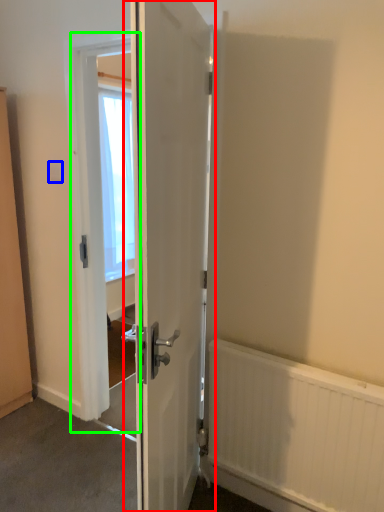
Question: Which object is positioned closest to door (highlighted by a red box)? Select from electric outlet (highlighted by a blue box) and screen door (highlighted by a green box).

Choices:
 (A) electric outlet
 (B) screen door

Answer: (B)